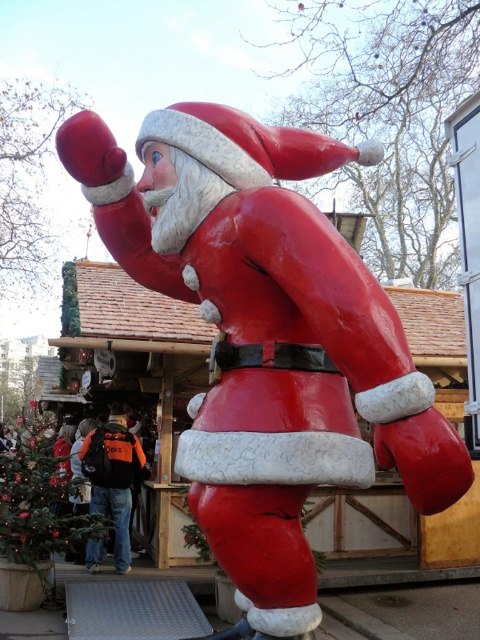
Does shiny plastic santa at center appear under orange backpack at center?

Incorrect, shiny plastic santa at center is not positioned below orange backpack at center.

Identify the location of shiny plastic santa at center. (266, 339).

Which is in front, point (348, 358) or point (146, 470)?

Point (348, 358) is more forward.

The image size is (480, 640). Find the location of `shiny plastic santa at center`. shiny plastic santa at center is located at coordinates (266, 339).